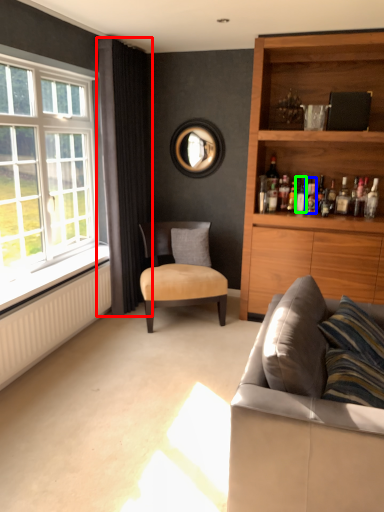
Question: Based on their relative distances, which object is farther from curtain (highlighted by a red box)? Choose from bottle (highlighted by a blue box) and bottle (highlighted by a green box).

Choices:
 (A) bottle
 (B) bottle

Answer: (A)